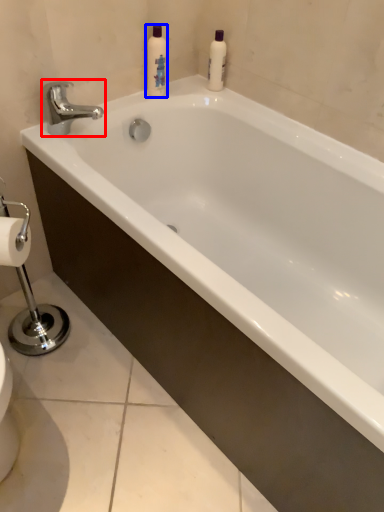
Question: Among these objects, which one is farthest to the camera, tap (highlighted by a red box) or cleaning product (highlighted by a blue box)?

Choices:
 (A) tap
 (B) cleaning product

Answer: (B)